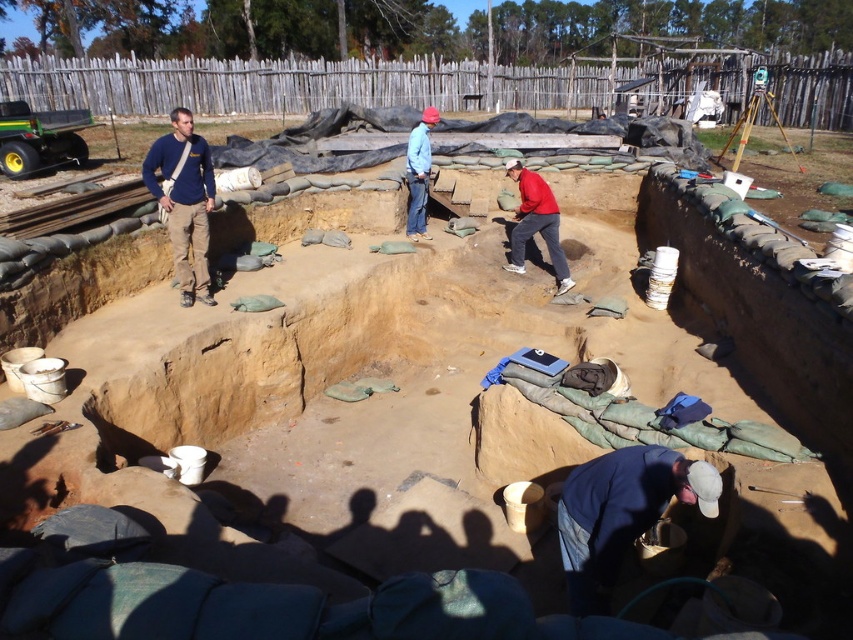
Is blue denim jacket at lower right to the right of blue cotton shirt at upper left from the viewer's perspective?

Indeed, blue denim jacket at lower right is positioned on the right side of blue cotton shirt at upper left.

How far apart are blue denim jacket at lower right and blue cotton shirt at upper left?

blue denim jacket at lower right is 14.92 feet from blue cotton shirt at upper left.

Which is behind, point (567, 515) or point (167, 154)?

The point (167, 154) is more distant.

Where is `blue denim jacket at lower right`? Image resolution: width=853 pixels, height=640 pixels. blue denim jacket at lower right is located at coordinates (621, 513).

Does blue cotton shirt at upper left have a smaller size compared to red matte jacket at center?

Correct, blue cotton shirt at upper left occupies less space than red matte jacket at center.

Which of these two, blue cotton shirt at upper left or red matte jacket at center, stands taller?

With more height is red matte jacket at center.

Which is in front, point (212, 180) or point (544, 236)?

Point (212, 180)

Locate an element on the screen. blue cotton shirt at upper left is located at coordinates (184, 200).

Who is positioned more to the right, blue denim jacket at lower right or red matte jacket at center?

From the viewer's perspective, red matte jacket at center appears more on the right side.

Is blue denim jacket at lower right to the right of red matte jacket at center from the viewer's perspective?

No, blue denim jacket at lower right is not to the right of red matte jacket at center.

Is point (601, 496) farther from viewer compared to point (527, 230)?

No, it is not.

This screenshot has width=853, height=640. Identify the location of blue denim jacket at lower right. (621, 513).